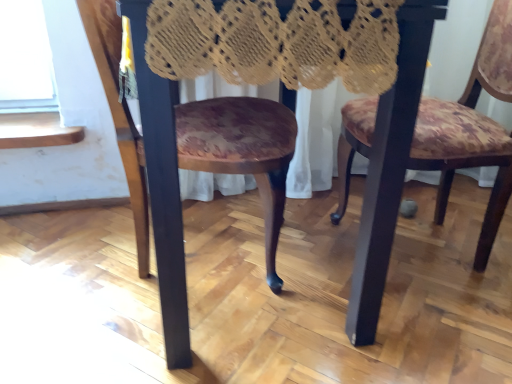
Question: From a real-world perspective, is floral fabric chair at center, marked as the second chair in a left-to-right arrangement, above or below wooden floral-patterned chair at center, placed as the 1th chair when sorted from left to right?

Choices:
 (A) above
 (B) below

Answer: (A)

Question: Looking at their shapes, would you say floral fabric chair at center, marked as the second chair in a left-to-right arrangement, is wider or thinner than wooden floral-patterned chair at center, which is the second chair from right to left?

Choices:
 (A) thin
 (B) wide

Answer: (A)

Question: Which is farther from the wooden floral-patterned chair at center, which is the second chair from right to left?

Choices:
 (A) floral fabric chair at center, marked as the second chair in a left-to-right arrangement
 (B) wooden table at center

Answer: (A)

Question: Which is farther from the floral fabric chair at center, marked as the second chair in a left-to-right arrangement?

Choices:
 (A) wooden floral-patterned chair at center, which is the second chair from right to left
 (B) wooden table at center

Answer: (A)